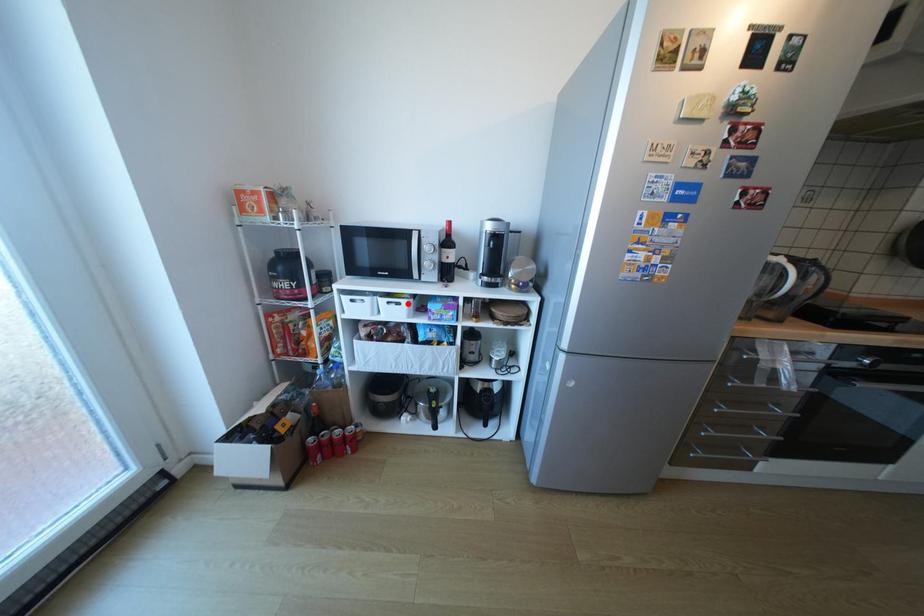
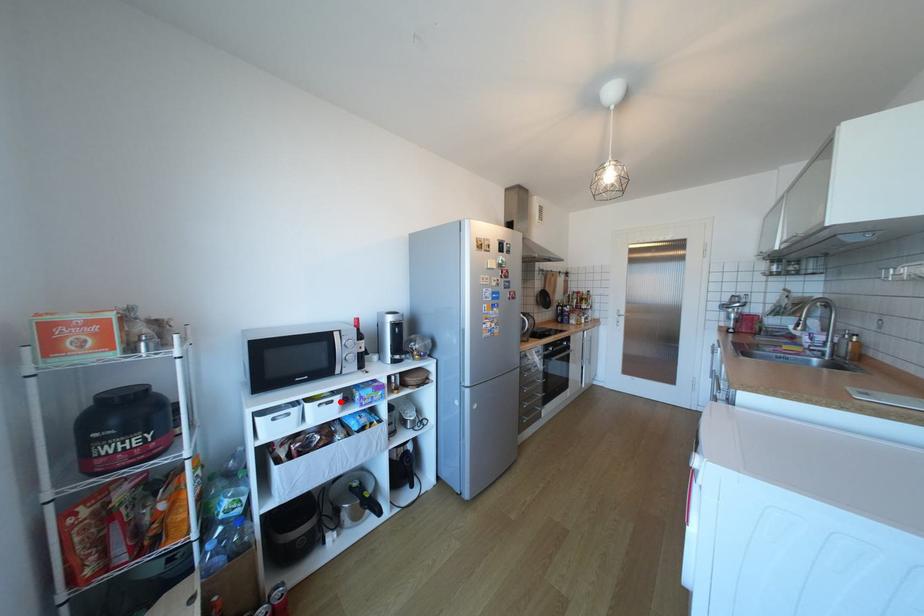
I am providing you with two images of the same scene from different viewpoints. A red point is marked on the first image and another point is marked on the second image. Do the highlighted points in image1 and image2 indicate the same real-world spot?

Yes